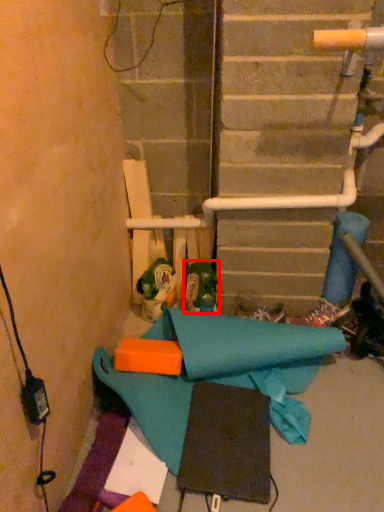
Question: Observing the image, what is the correct spatial positioning of footwear (annotated by the red box) in reference to toy?

Choices:
 (A) left
 (B) right

Answer: (B)